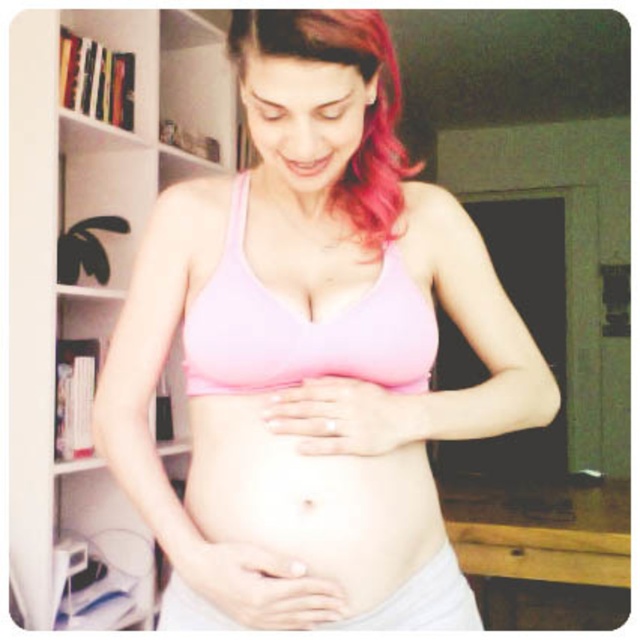
Is white wooden bookshelf at left further to the viewer compared to pink matte hair at upper center?

Yes, it is behind pink matte hair at upper center.

This screenshot has width=640, height=640. What do you see at coordinates (90, 285) in the screenshot?
I see `white wooden bookshelf at left` at bounding box center [90, 285].

I want to click on white wooden bookshelf at left, so click(90, 285).

Is white wooden bookshelf at left bigger than matte pink bikini top at center?

Correct, white wooden bookshelf at left is larger in size than matte pink bikini top at center.

Which of these two, white wooden bookshelf at left or matte pink bikini top at center, stands taller?

white wooden bookshelf at left

Is point (65, 218) positioned behind point (204, 346)?

Yes.

Find the location of a particular element. The width and height of the screenshot is (640, 640). white wooden bookshelf at left is located at coordinates (90, 285).

Does pink matte bra at center have a greater height compared to white wooden bookshelf at left?

Incorrect, pink matte bra at center's height is not larger of white wooden bookshelf at left's.

Between point (324, 307) and point (186, 467), which one is positioned behind?

Point (186, 467)

This screenshot has height=640, width=640. In order to click on pink matte bra at center in this screenshot , I will do `click(310, 353)`.